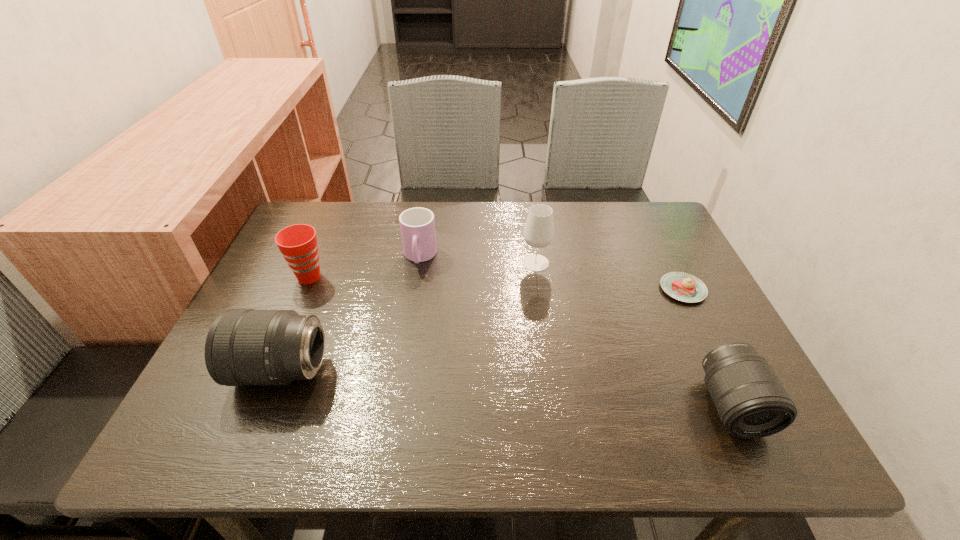
The width and height of the screenshot is (960, 540). In order to click on object at the far edge in this screenshot , I will do `click(417, 225)`.

Where is `telephoto lens situated at the left edge`? This screenshot has height=540, width=960. telephoto lens situated at the left edge is located at coordinates (243, 347).

Locate an element on the screen. The width and height of the screenshot is (960, 540). cup that is at the left edge is located at coordinates (298, 243).

Find the location of a particular element. This screenshot has height=540, width=960. telephoto lens located in the right edge section of the desktop is located at coordinates (751, 402).

What are the coordinates of `pastry that is at the right edge` in the screenshot? It's located at (684, 287).

Find the location of a particular element. This screenshot has width=960, height=540. object that is positioned at the near left corner is located at coordinates (243, 347).

Find the location of a particular element. object that is at the near right corner is located at coordinates (751, 402).

At what (x,y) coordinates should I click in order to perform the action: click on free space at the far edge of the desktop. Please return your answer as a coordinate pair (x, y). The height and width of the screenshot is (540, 960). Looking at the image, I should click on (575, 239).

Where is `vacant space at the near edge of the desktop`? The image size is (960, 540). vacant space at the near edge of the desktop is located at coordinates (552, 372).

At what (x,y) coordinates should I click in order to perform the action: click on vacant area at the left edge of the desktop. Please return your answer as a coordinate pair (x, y). This screenshot has height=540, width=960. Looking at the image, I should click on point(282,285).